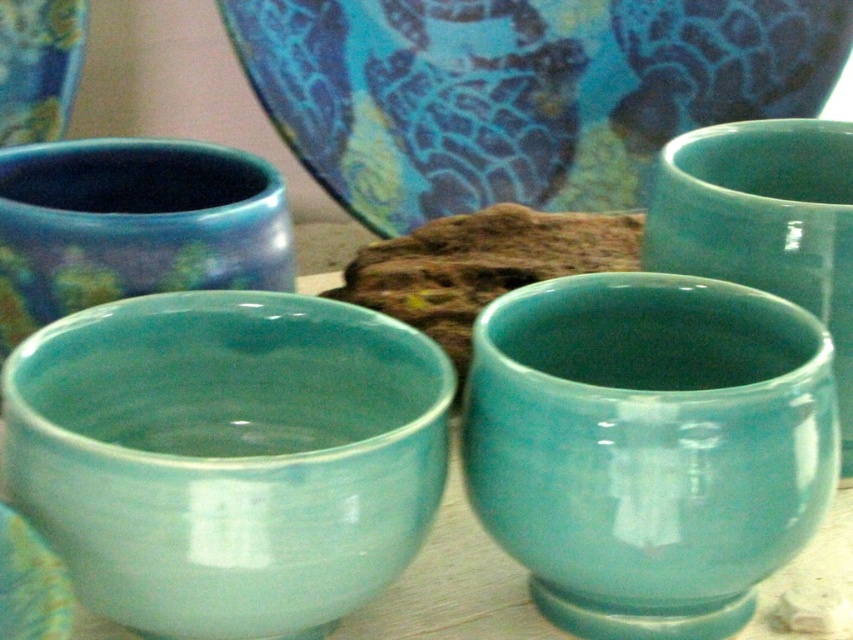
Between point (238, 486) and point (795, 452), which one is positioned behind?

The point (795, 452) is more distant.

Identify the location of matte ceramic bowl at center. The width and height of the screenshot is (853, 640). (227, 456).

Is point (117, 317) less distant than point (477, 472)?

No.

I want to click on matte ceramic bowl at center, so click(227, 456).